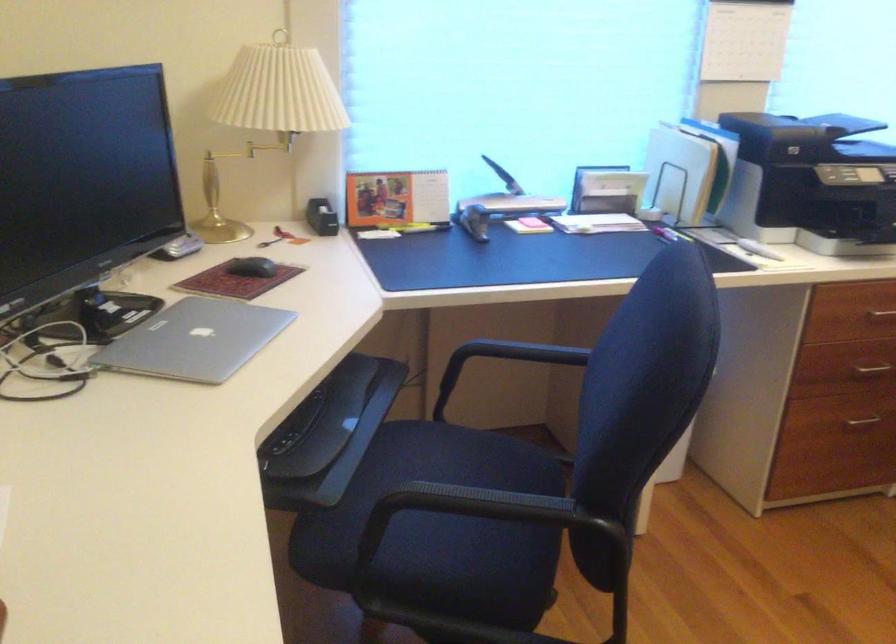
Find where to lift the silver laptop. Please return your answer as a coordinate pair (x, y).

(194, 339)